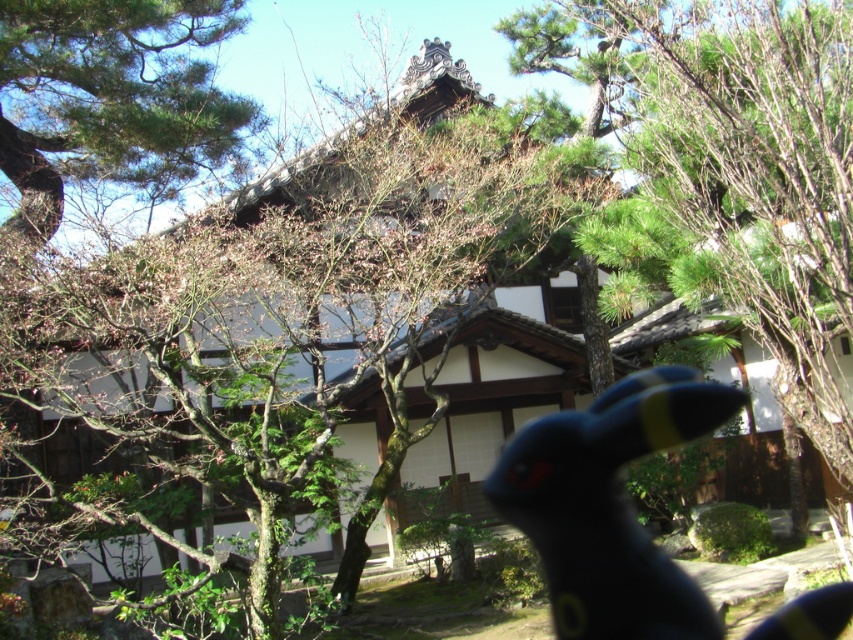
Question: Does green leafy tree at center have a smaller size compared to black rubber toy at center?

Choices:
 (A) no
 (B) yes

Answer: (A)

Question: Can you confirm if green leafy tree at center is bigger than green leafy tree at upper left?

Choices:
 (A) yes
 (B) no

Answer: (A)

Question: Which point is closer to the camera?

Choices:
 (A) black rubber toy at center
 (B) green leafy tree at upper left

Answer: (A)

Question: Which of these objects is positioned farthest from the green leafy tree at center?

Choices:
 (A) black rubber toy at center
 (B) green leafy tree at upper left

Answer: (A)

Question: Is green leafy tree at center to the right of green leafy tree at upper left from the viewer's perspective?

Choices:
 (A) no
 (B) yes

Answer: (B)

Question: Among these points, which one is farthest from the camera?

Choices:
 (A) (167, 100)
 (B) (7, 352)

Answer: (A)